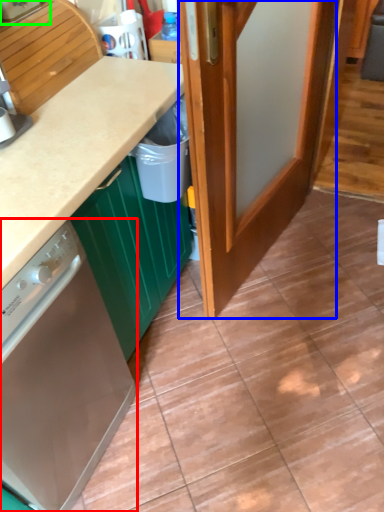
Question: Estimate the real-world distances between objects in this image. Which object is closer to home appliance (highlighted by a red box), door (highlighted by a blue box) or kitchen appliance (highlighted by a green box)?

Choices:
 (A) door
 (B) kitchen appliance

Answer: (A)